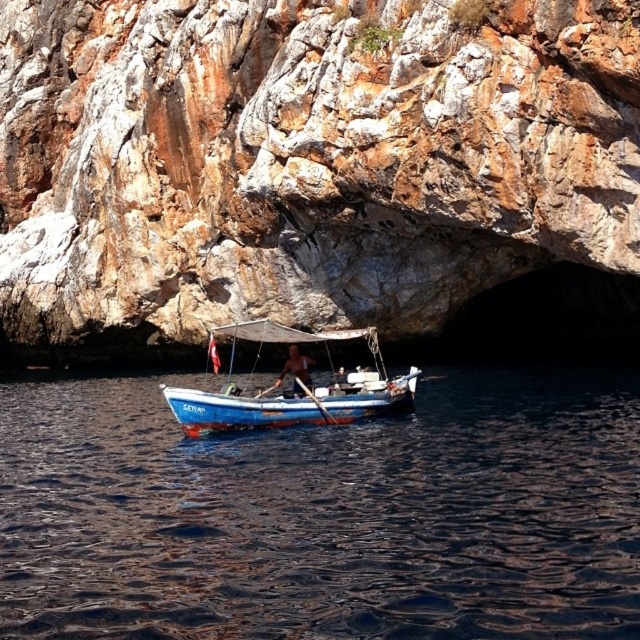
Question: Is rusty stone cave at center behind dark blue water at center?

Choices:
 (A) no
 (B) yes

Answer: (B)

Question: Can you confirm if dark blue water at center is bigger than blue painted wood boat at center?

Choices:
 (A) no
 (B) yes

Answer: (B)

Question: Which point is farther to the camera?

Choices:
 (A) rusty stone cave at center
 (B) brown wooden oar at center
 (C) blue painted wood boat at center
 (D) dark blue water at center

Answer: (B)

Question: Does dark blue water at center have a smaller size compared to blue painted wood boat at center?

Choices:
 (A) yes
 (B) no

Answer: (B)

Question: Which object is closer to the camera taking this photo?

Choices:
 (A) rusty stone cave at center
 (B) blue painted wood boat at center
 (C) brown wooden oar at center

Answer: (B)

Question: Which point is closer to the camera?

Choices:
 (A) blue painted wood boat at center
 (B) rusty stone cave at center
 (C) dark blue water at center

Answer: (C)